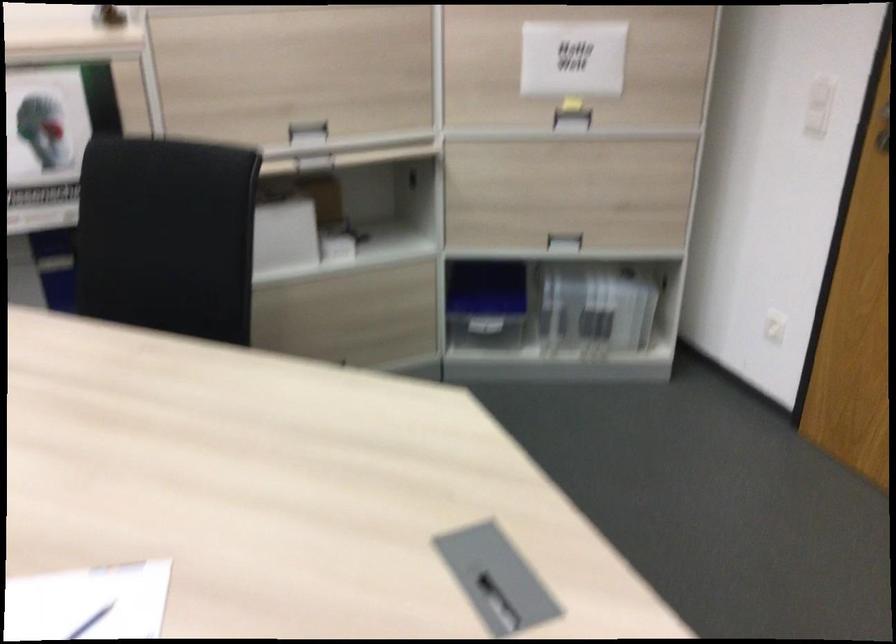
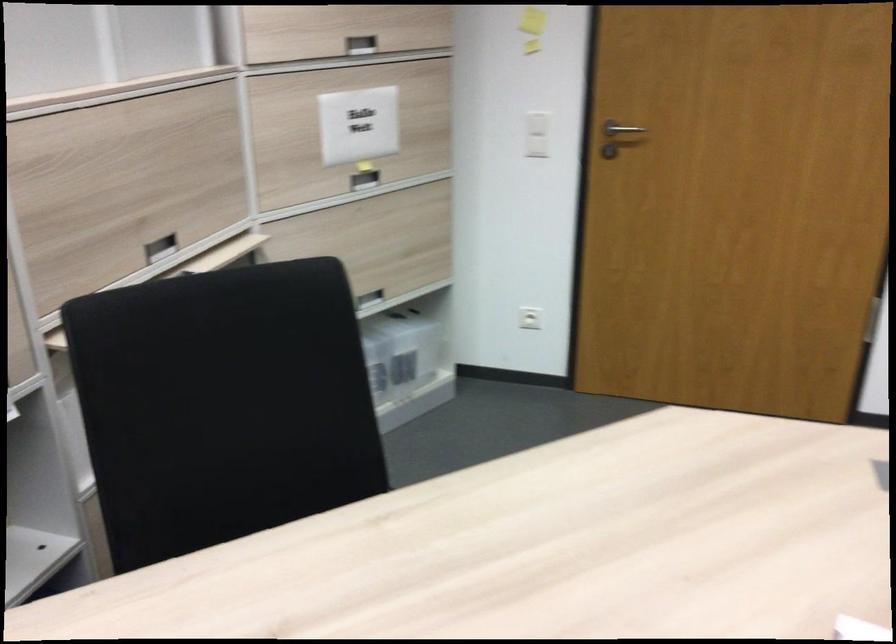
The point at (307, 133) is marked in the first image. Where is the corresponding point in the second image?

(159, 247)